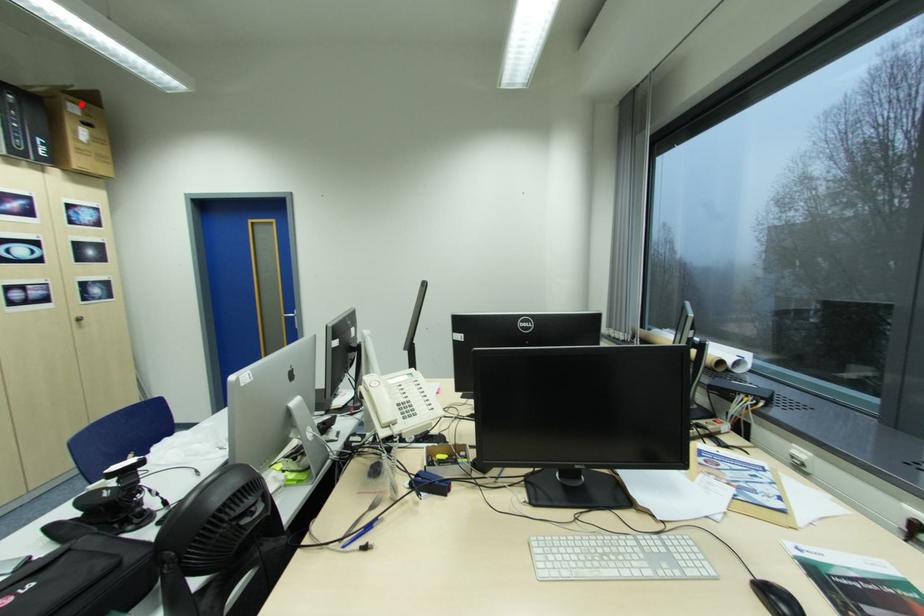
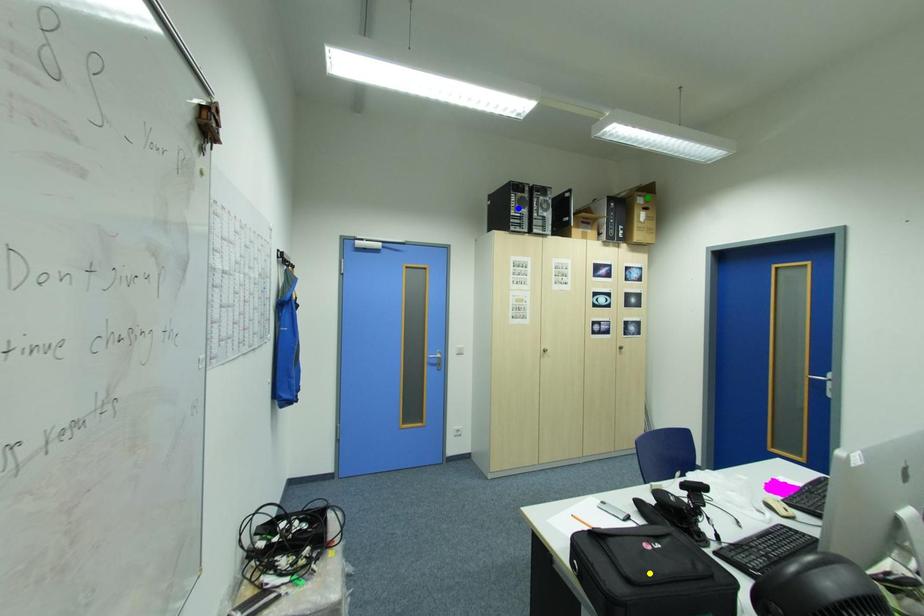
Question: I am providing you with two images of the same scene from different viewpoints. A red point is marked on the first image. You are given multiple points on the second image. In image 2, which mark is for the same physical point as the one in image 1?

Choices:
 (A) yellow point
 (B) green point
 (C) blue point

Answer: (B)